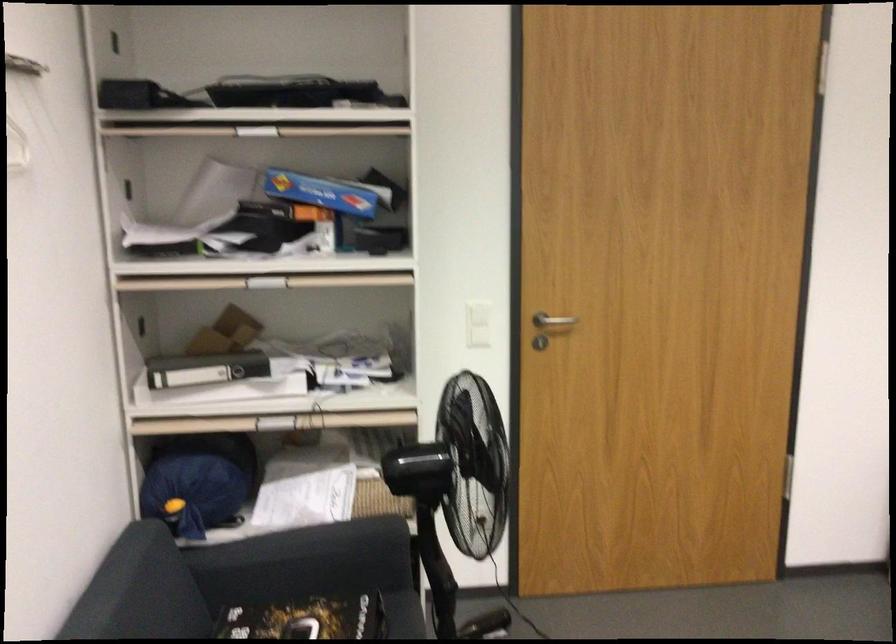
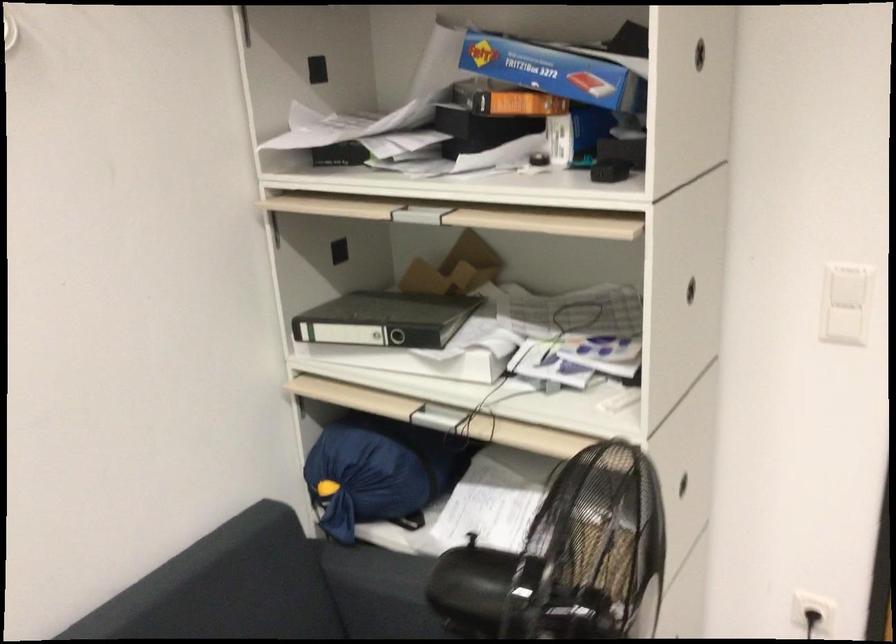
Where in the second image is the point corresponding to (220,365) from the first image?

(385, 319)